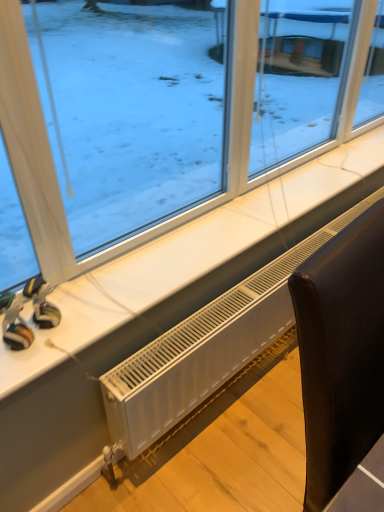
Identify the location of blank space situated above white plastic radiator at lower center (from a real-world perspective). (248, 290).